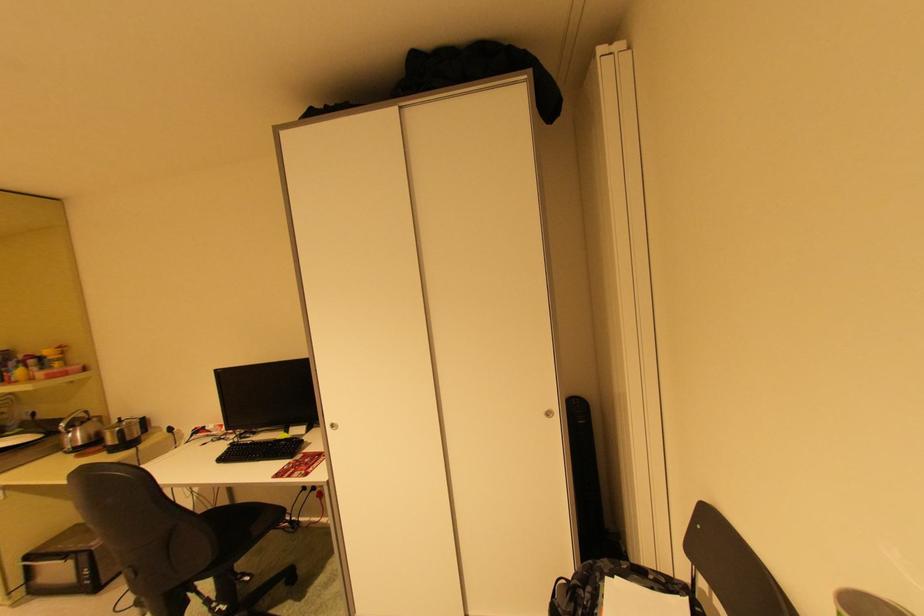
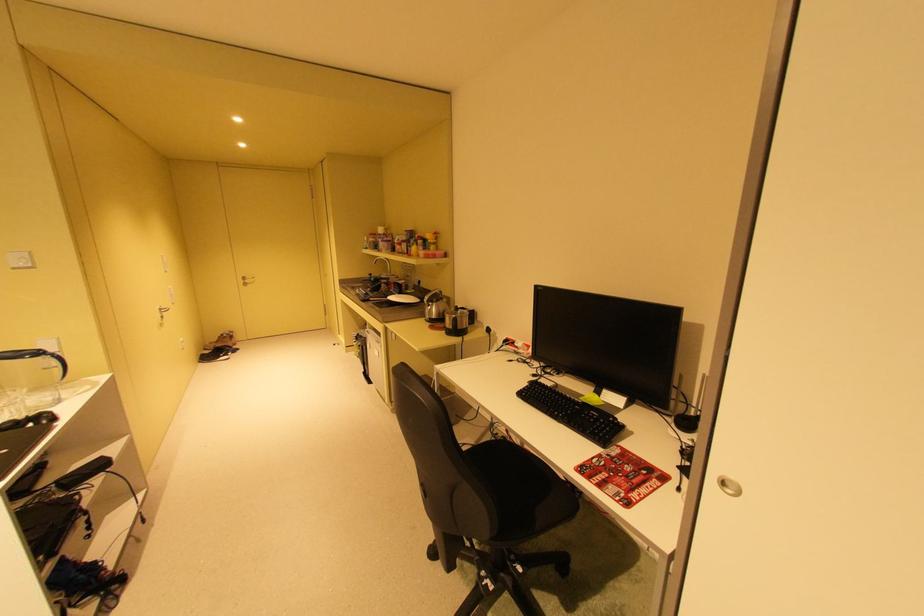
Where in the second image is the point corresponding to [294,445] from the first image?

(604, 419)